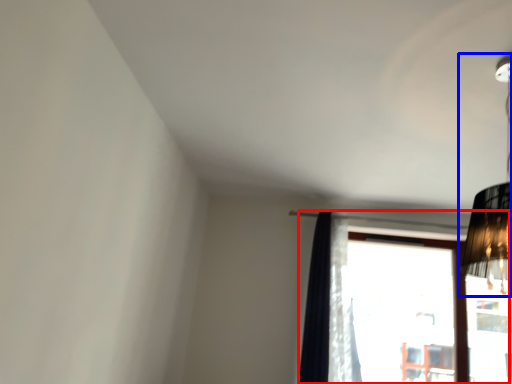
Question: Which point is closer to the camera, window (highlighted by a red box) or lamp (highlighted by a blue box)?

Choices:
 (A) window
 (B) lamp

Answer: (B)